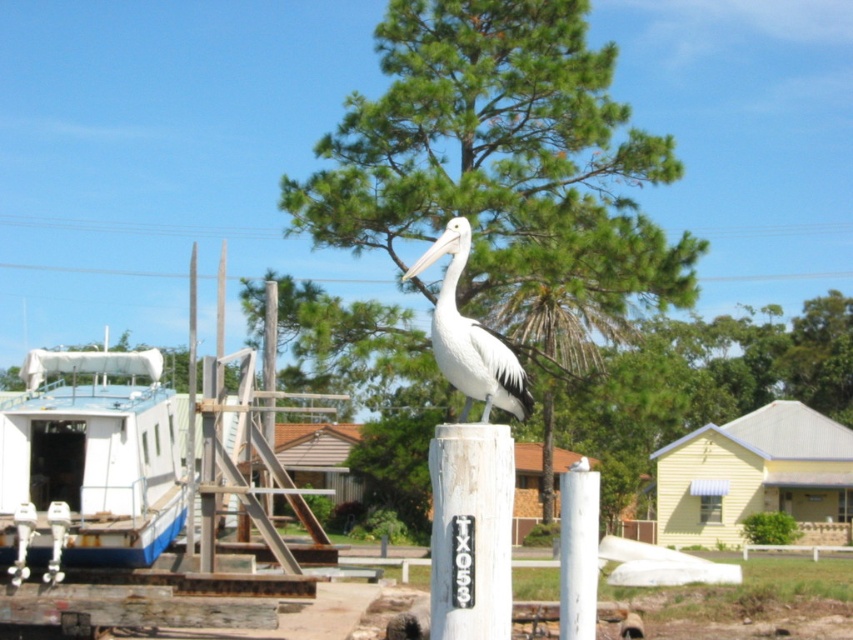
Question: Is white matte boat at left thinner than white painted wood post at center?

Choices:
 (A) yes
 (B) no

Answer: (A)

Question: Which of the following is the closest to the observer?

Choices:
 (A) (163, 412)
 (B) (595, 580)
 (C) (524, 410)
 (D) (322, 321)

Answer: (C)

Question: Is white matte boat at left smaller than white matte pelican at center?

Choices:
 (A) no
 (B) yes

Answer: (A)

Question: Estimate the real-world distances between objects in this image. Which object is closer to the white matte pelican at center?

Choices:
 (A) green leafy tree at center
 (B) white wood post at center
 (C) white matte boat at left
 (D) white painted wood post at center

Answer: (B)

Question: Is white matte pelican at center positioned in front of white painted wood post at center?

Choices:
 (A) no
 (B) yes

Answer: (B)

Question: Which object is positioned farthest from the white matte boat at left?

Choices:
 (A) white wood post at center
 (B) white painted wood post at center
 (C) green leafy tree at center
 (D) white matte pelican at center

Answer: (C)